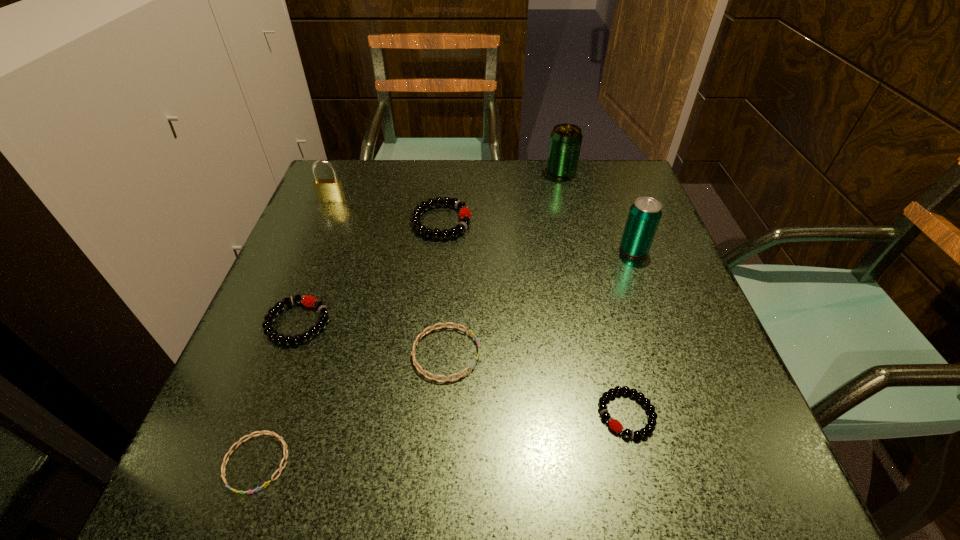
Select which bracelet is the third closest to the tallest bracelet. Please provide its 2D coordinates. Your answer should be formatted as a tuple, i.e. [(x, y)], where the tuple contains the x and y coordinates of a point satisfying the conditions above.

[(614, 424)]

Identify which bracelet is located as the fourth nearest to the second farthest object. Please provide its 2D coordinates. Your answer should be formatted as a tuple, i.e. [(x, y)], where the tuple contains the x and y coordinates of a point satisfying the conditions above.

[(249, 436)]

Identify which black bracelet is located as the third nearest to the right blue bracelet. Please provide its 2D coordinates. Your answer should be formatted as a tuple, i.e. [(x, y)], where the tuple contains the x and y coordinates of a point satisfying the conditions above.

[(464, 213)]

I want to click on black bracelet that is the second nearest to the farthest black bracelet, so click(x=614, y=424).

Find the location of a particular element. The height and width of the screenshot is (540, 960). free space that satisfies the following two spatial constraints: 1. on the front-facing side of the seventh nearest object; 2. on the right side of the tallest bracelet is located at coordinates (324, 221).

You are a GUI agent. You are given a task and a screenshot of the screen. Output one action in this format:
    pyautogui.click(x=<x>, y=<y>)
    Task: Click on the free spot that satisfies the following two spatial constraints: 1. on the surface of the rightmost bracelet showing star-shaped elements; 2. on the left side of the right blue bracelet
    
    Given the screenshot: What is the action you would take?
    pyautogui.click(x=442, y=414)

You are a GUI agent. You are given a task and a screenshot of the screen. Output one action in this format:
    pyautogui.click(x=<x>, y=<y>)
    Task: Click on the blank area in the image that satisfies the following two spatial constraints: 1. on the back side of the farthest object; 2. on the right side of the fourth tallest object
    Image resolution: width=960 pixels, height=540 pixels.
    Given the screenshot: What is the action you would take?
    pyautogui.click(x=446, y=172)

Locate an element on the screen. Image resolution: width=960 pixels, height=540 pixels. vacant region that satisfies the following two spatial constraints: 1. on the front side of the nearer beer can; 2. on the surface of the farther blue bracelet showing star-shaped elements is located at coordinates (672, 354).

Image resolution: width=960 pixels, height=540 pixels. Identify the location of vacant space that satisfies the following two spatial constraints: 1. on the front-facing side of the padlock; 2. on the right side of the fifth shortest object. tap(324, 221).